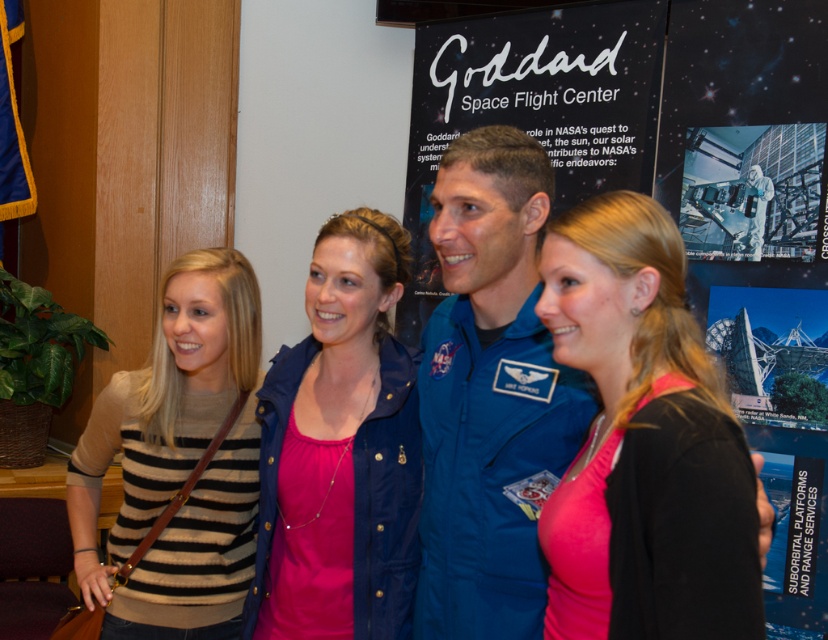
You are standing in front of the NASA Goddard Space Flight Center backdrop and notice the navy blue jacket at center. If you want to place a name tag exactly 10 cm to the right of the jacket, where should you position it?

The navy blue jacket at center is located at point (340,451). To place the name tag 10 cm to the right, you would position it at point (340,515), assuming the coordinate system increases to the right.

You are attending a NASA event and notice two people in the image. One is wearing a blue fabric astronaut suit at center and the other has a striped sweater at left. If you were standing in front of them, which person would be closer to your right side?

The blue fabric astronaut suit at center is positioned on the right side of striped sweater at left, so the person in the blue fabric astronaut suit at center would be closer to your right side.